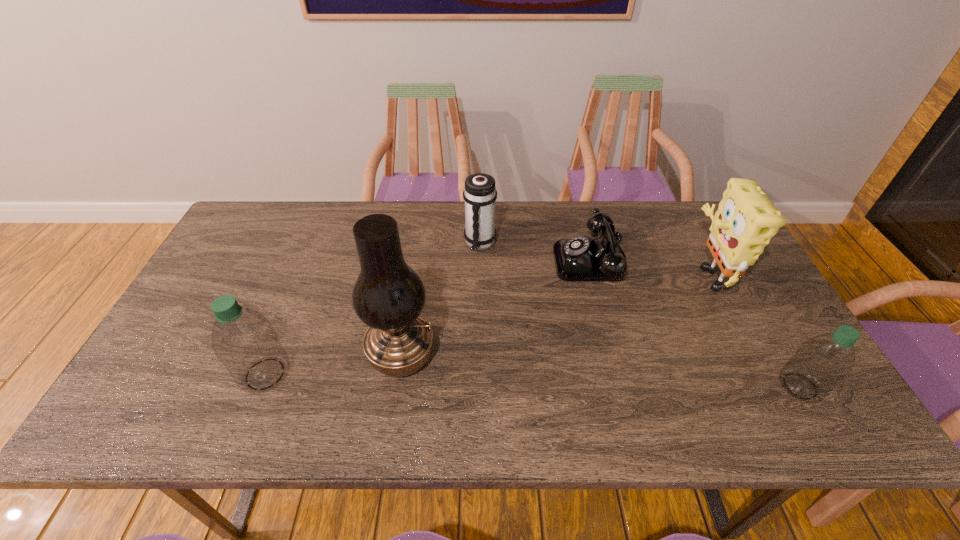
Locate an element on the screen. The height and width of the screenshot is (540, 960). vacant space that satisfies the following two spatial constraints: 1. on the side with the handle of the thermos bottle; 2. on the right side of the shorter water bottle is located at coordinates (480, 386).